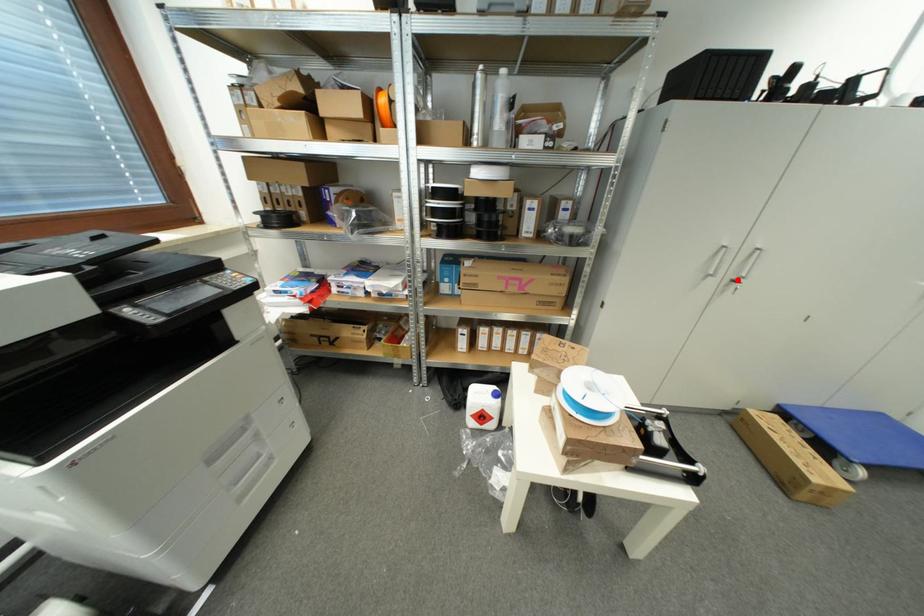
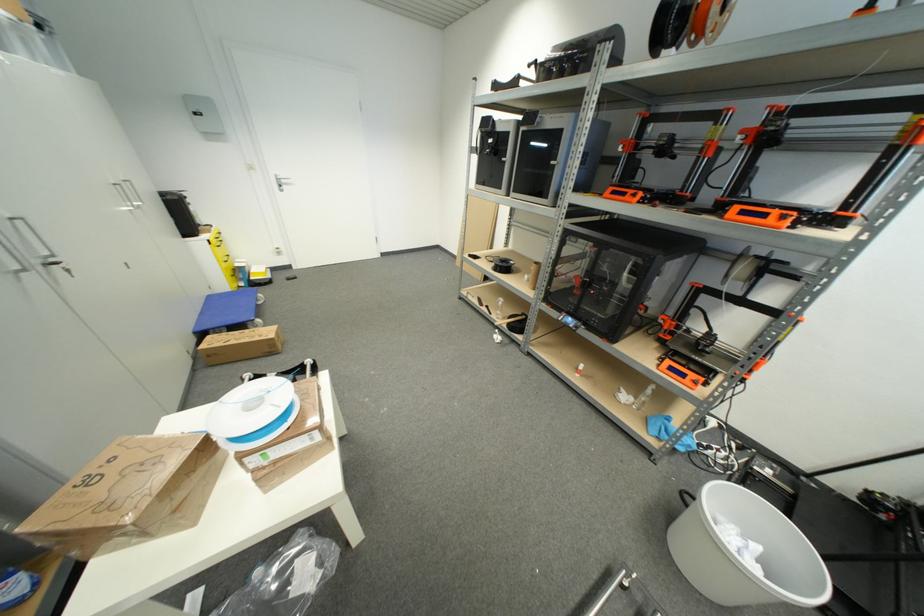
Question: I am providing you with two images of the same scene from different viewpoints. Given a red point in image1, look at the same physical point in image2. Is it:

Choices:
 (A) Closer to the viewpoint
 (B) Farther from the viewpoint

Answer: (B)